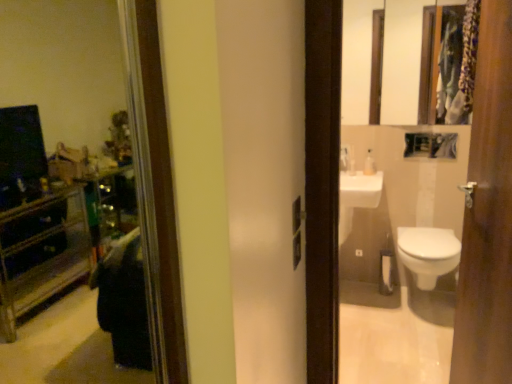
Question: Does wooden door at right have a lesser width compared to white glossy soap dispenser at upper center?

Choices:
 (A) no
 (B) yes

Answer: (A)

Question: From a real-world perspective, is wooden door at right positioned over white glossy soap dispenser at upper center based on gravity?

Choices:
 (A) yes
 (B) no

Answer: (B)

Question: Could you tell me if wooden door at right is turned towards white glossy soap dispenser at upper center?

Choices:
 (A) yes
 (B) no

Answer: (B)

Question: Can you confirm if wooden door at right is shorter than white glossy soap dispenser at upper center?

Choices:
 (A) yes
 (B) no

Answer: (B)

Question: Considering the relative sizes of wooden door at right and white glossy soap dispenser at upper center in the image provided, is wooden door at right bigger than white glossy soap dispenser at upper center?

Choices:
 (A) no
 (B) yes

Answer: (B)

Question: From the image's perspective, does wooden door at right appear higher than white glossy soap dispenser at upper center?

Choices:
 (A) yes
 (B) no

Answer: (B)

Question: Can you confirm if white glossy toilet at lower right is positioned to the left of wooden framed mirror at upper right?

Choices:
 (A) no
 (B) yes

Answer: (A)

Question: Is white glossy toilet at lower right smaller than wooden framed mirror at upper right?

Choices:
 (A) no
 (B) yes

Answer: (A)

Question: Does white glossy toilet at lower right turn towards wooden framed mirror at upper right?

Choices:
 (A) no
 (B) yes

Answer: (A)

Question: Does white glossy toilet at lower right have a lesser height compared to wooden framed mirror at upper right?

Choices:
 (A) yes
 (B) no

Answer: (A)

Question: From the image's perspective, does white glossy toilet at lower right appear lower than wooden framed mirror at upper right?

Choices:
 (A) no
 (B) yes

Answer: (B)

Question: Considering the relative sizes of white glossy toilet at lower right and wooden framed mirror at upper right in the image provided, is white glossy toilet at lower right wider than wooden framed mirror at upper right?

Choices:
 (A) yes
 (B) no

Answer: (A)

Question: From a real-world perspective, is wooden door at right on top of white glossy toilet at lower right?

Choices:
 (A) no
 (B) yes

Answer: (B)